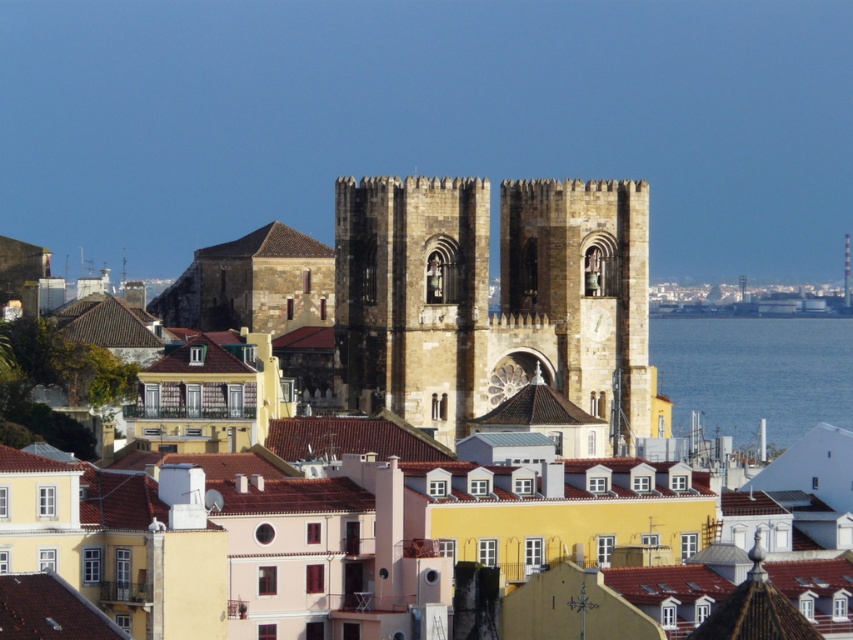
Which is in front, point (595, 230) or point (660, 348)?

Point (595, 230)

Identify the location of brown stone clock tower at center. The height and width of the screenshot is (640, 853). (584, 289).

I want to click on brown stone clock tower at center, so click(584, 289).

Does brown stone church at center have a smaller size compared to brown stone clock tower at center?

Incorrect, brown stone church at center is not smaller in size than brown stone clock tower at center.

Looking at this image, who is more distant from viewer, (486, 506) or (544, 266)?

The point (544, 266) is behind.

Between point (518, 368) and point (554, 241), which one is positioned behind?

Positioned behind is point (518, 368).

Find the location of a particular element. The height and width of the screenshot is (640, 853). brown stone church at center is located at coordinates (386, 445).

Is point (387, 212) less distant than point (703, 420)?

Yes.

Is brown stone tower at center smaller than blue water at right?

No, brown stone tower at center is not smaller than blue water at right.

Is point (368, 208) behind point (807, 340)?

That is False.

You are a GUI agent. You are given a task and a screenshot of the screen. Output one action in this format:
    pyautogui.click(x=<x>, y=<y>)
    Task: Click on the brown stone tower at center
    
    Given the screenshot: What is the action you would take?
    pyautogui.click(x=490, y=300)